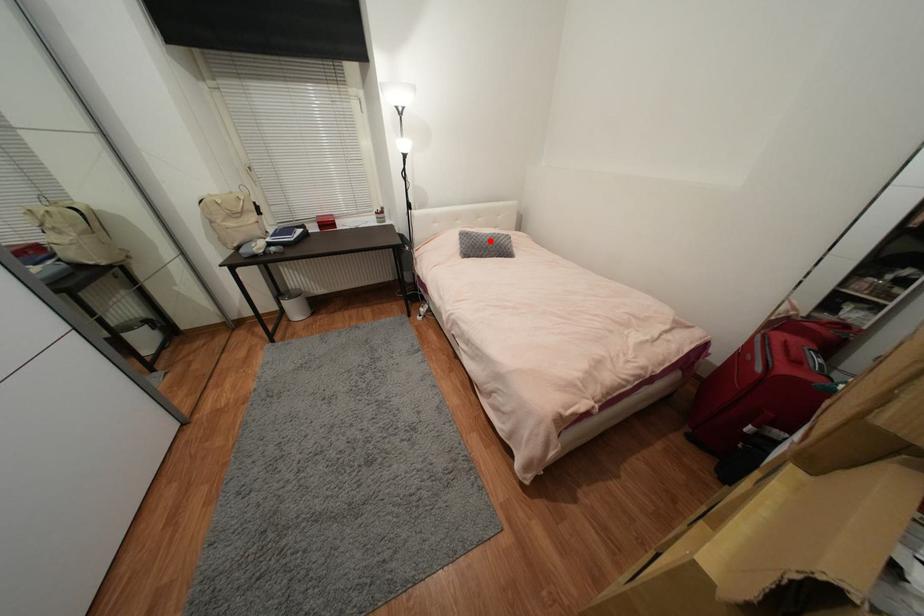
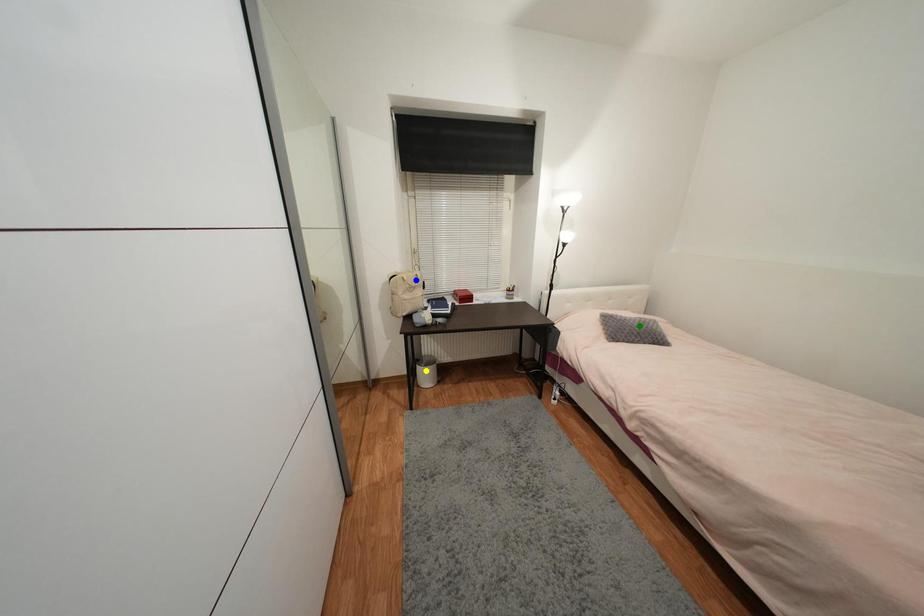
Question: I am providing you with two images of the same scene from different viewpoints. A red point is marked on the first image. You are given multiple points on the second image. Which mark in image 2 goes with the point in image 1?

Choices:
 (A) blue point
 (B) yellow point
 (C) green point

Answer: (C)